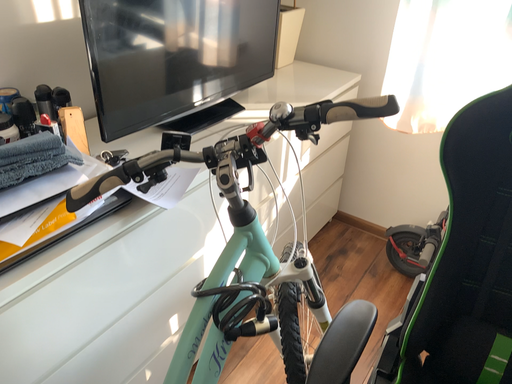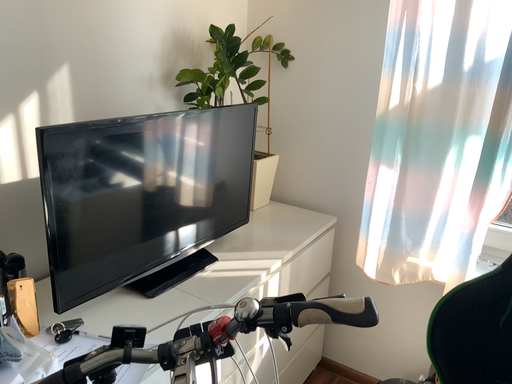
Question: How did the camera likely rotate when shooting the video?

Choices:
 (A) rotated downward
 (B) rotated upward

Answer: (B)